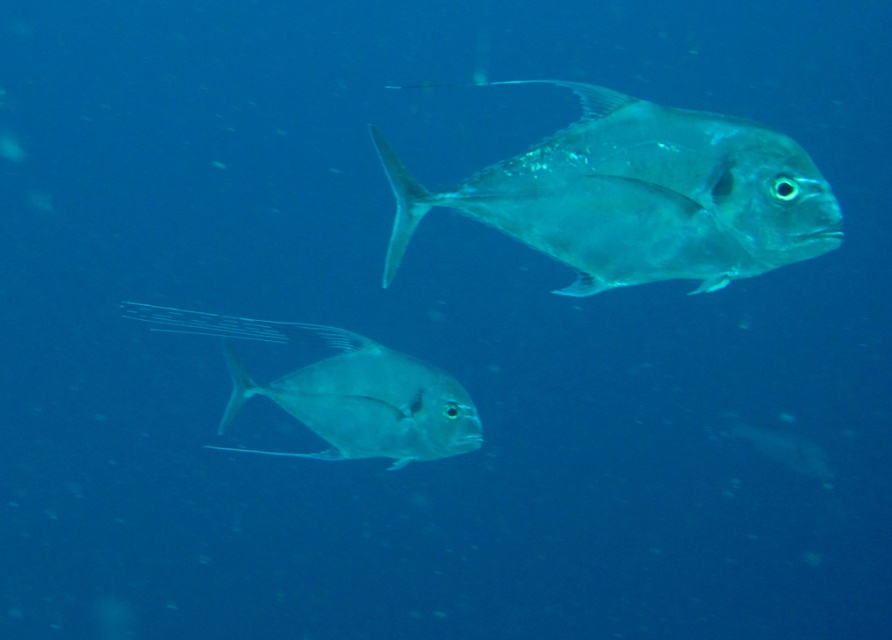
You are a marine biologist observing two fish underwater. You notice a point at coordinates (640, 196). Which fish is this point located on?

The point at coordinates (640, 196) is located on the translucent silver fish at upper right.

You are a marine biologist observing two points in the underwater scene. The first point is labeled as point [709,205] and the second as point [299,397]. Based on your observation, which point is nearer to the camera?

Point [709,205] is closer to the camera than point [299,397].